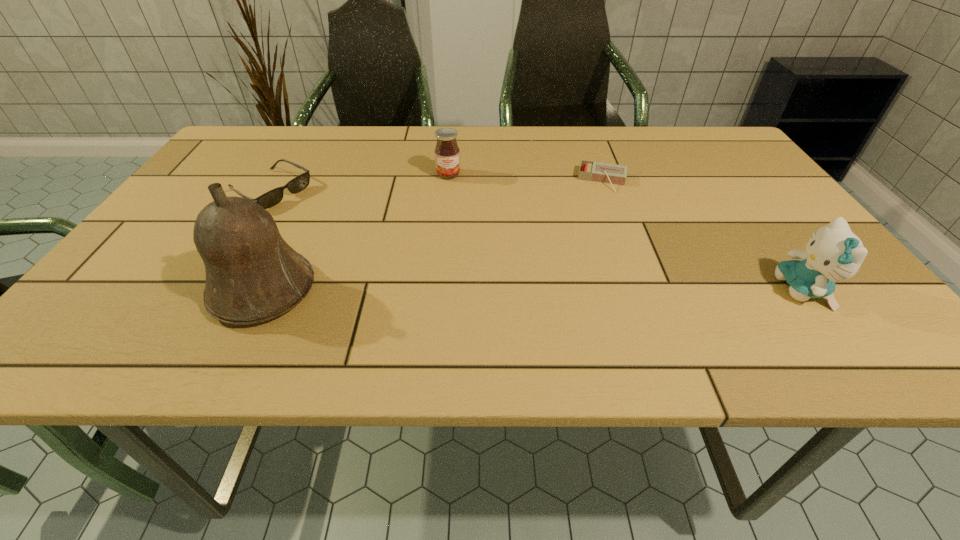
Locate an element on the screen. The width and height of the screenshot is (960, 540). object that can be found as the closest to the third object from left to right is located at coordinates (600, 172).

I want to click on blank space that satisfies the following two spatial constraints: 1. on the front side of the third tallest object; 2. on the right side of the shortest object, so click(448, 180).

Identify the location of free space that satisfies the following two spatial constraints: 1. on the back side of the second shortest object; 2. on the right side of the matchbox. This screenshot has height=540, width=960. (277, 180).

Locate an element on the screen. This screenshot has width=960, height=540. free space that satisfies the following two spatial constraints: 1. on the back side of the fourth tallest object; 2. on the right side of the matchbox is located at coordinates (277, 180).

Where is `free space that satisfies the following two spatial constraints: 1. on the front side of the shortest object; 2. on the face of the kitten`? free space that satisfies the following two spatial constraints: 1. on the front side of the shortest object; 2. on the face of the kitten is located at coordinates (644, 290).